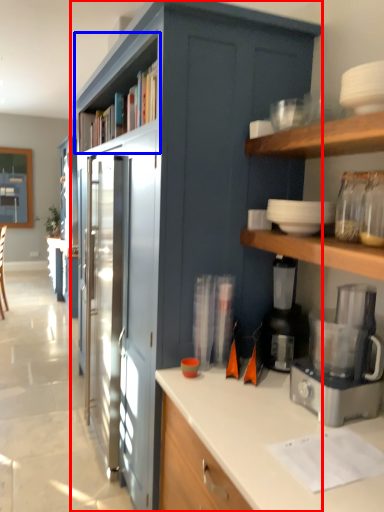
Question: Which of the following is the farthest to the observer, cabinetry (highlighted by a red box) or shelf (highlighted by a blue box)?

Choices:
 (A) cabinetry
 (B) shelf

Answer: (B)